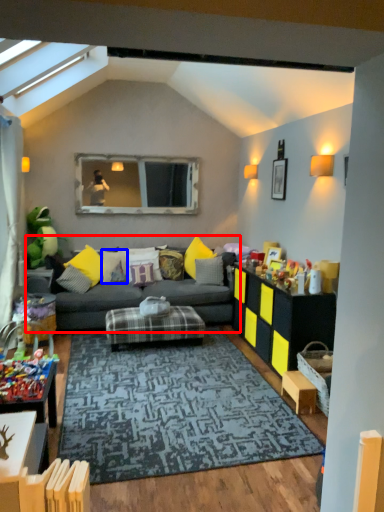
Question: Which of the following is the closest to the observer, studio couch (highlighted by a red box) or pillow (highlighted by a blue box)?

Choices:
 (A) studio couch
 (B) pillow

Answer: (A)